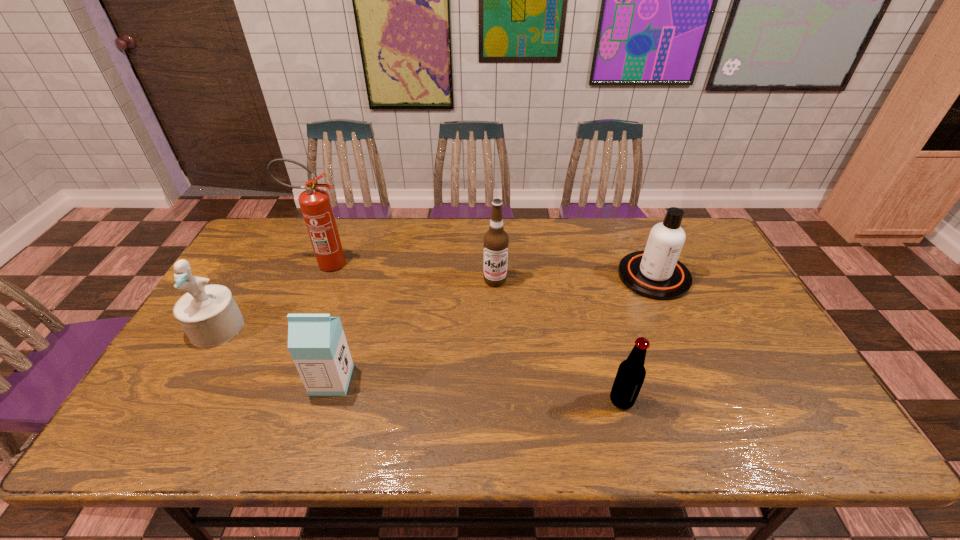
This screenshot has width=960, height=540. I want to click on free point at the far edge, so click(577, 237).

Identify the location of free space at the near edge. (379, 435).

Where is `vacant space at the left edge`? Image resolution: width=960 pixels, height=540 pixels. vacant space at the left edge is located at coordinates (187, 386).

This screenshot has width=960, height=540. In order to click on free space at the right edge in this screenshot , I will do `click(770, 385)`.

The height and width of the screenshot is (540, 960). In the image, there is a desktop. In order to click on vacant space at the far left corner in this screenshot , I will do `click(289, 228)`.

Find the location of a particular element. Image resolution: width=960 pixels, height=540 pixels. free spot between the third object from right to left and the fifth object from left to right is located at coordinates (559, 340).

The image size is (960, 540). In order to click on vacant area between the fifth object from right to left and the leftmost object in this screenshot , I will do `click(272, 296)`.

Where is `empty space between the beer bottle and the milk carton`? empty space between the beer bottle and the milk carton is located at coordinates (477, 390).

Find the location of a particular element. This screenshot has width=960, height=540. vacant area that lies between the third object from right to left and the milk carton is located at coordinates (414, 330).

The height and width of the screenshot is (540, 960). Find the location of `free spot between the second tallest object and the leftmost object`. free spot between the second tallest object and the leftmost object is located at coordinates (356, 304).